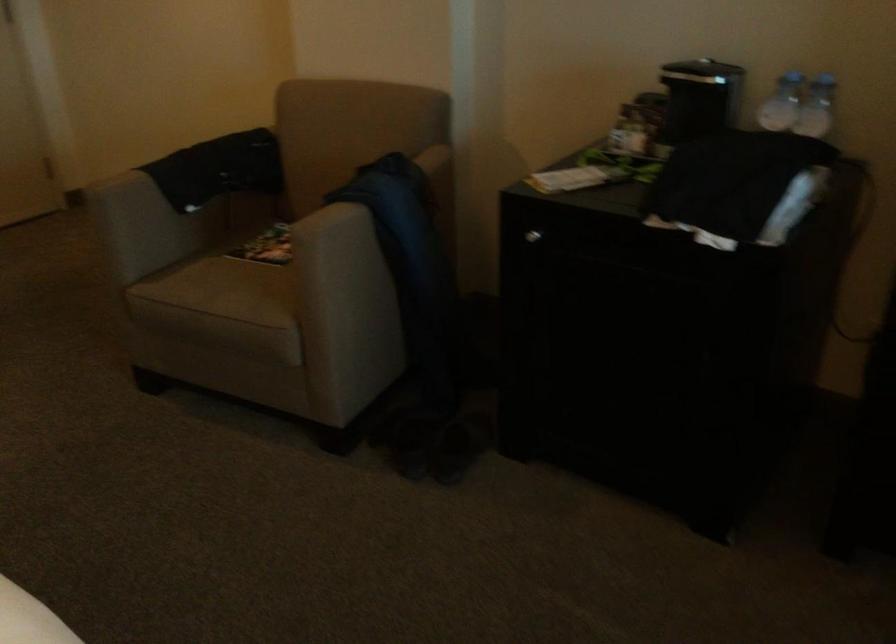
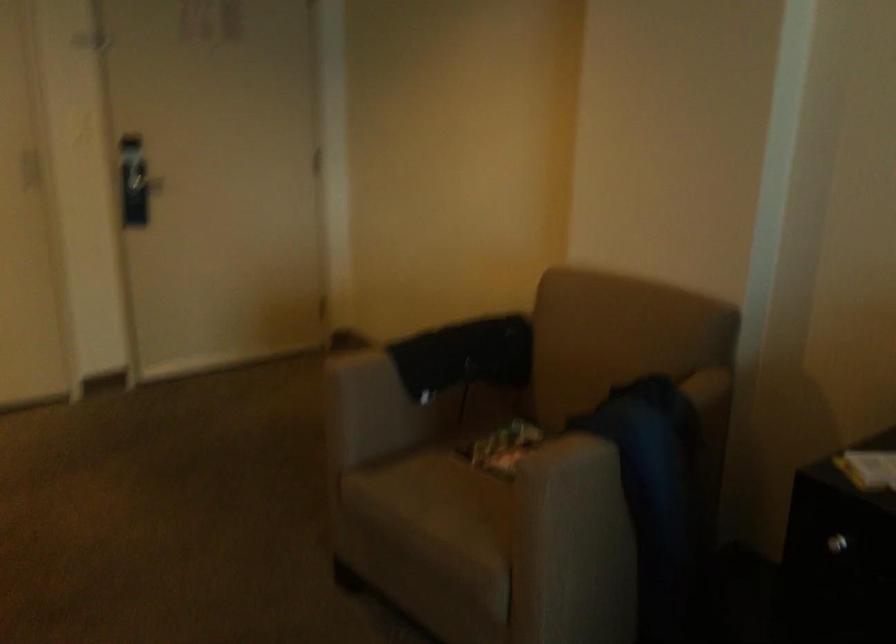
Question: The first image is from the beginning of the video and the second image is from the end. How did the camera likely rotate when shooting the video?

Choices:
 (A) Left
 (B) Right
 (C) Up
 (D) Down

Answer: (A)